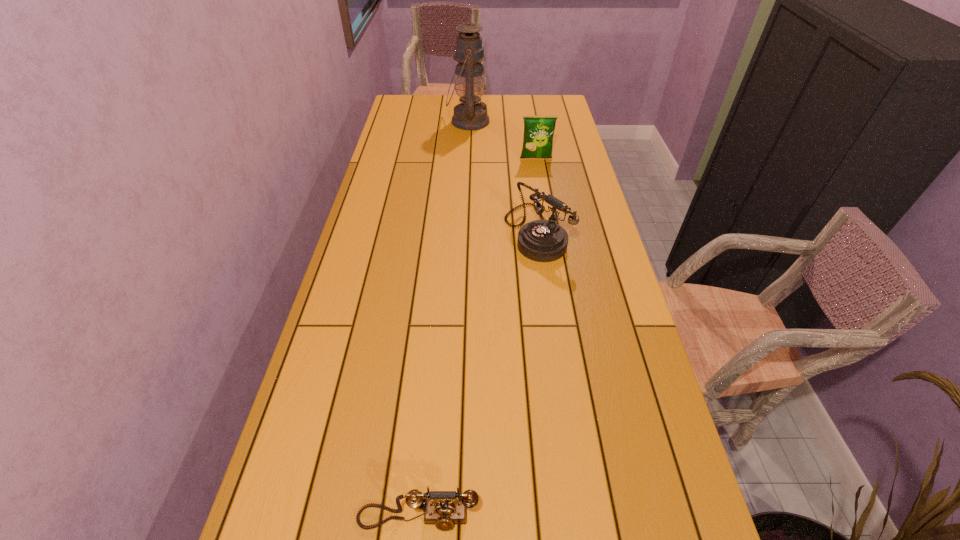
You are a GUI agent. You are given a task and a screenshot of the screen. Output one action in this format:
    pyautogui.click(x=<x>, y=<y>)
    Task: Click on the object that is at the far edge
    
    Given the screenshot: What is the action you would take?
    pyautogui.click(x=469, y=53)

Image resolution: width=960 pixels, height=540 pixels. I want to click on crisp (potato chip) that is at the right edge, so tap(538, 130).

You are a GUI agent. You are given a task and a screenshot of the screen. Output one action in this format:
    pyautogui.click(x=<x>, y=<y>)
    Task: Click on the telephone present at the right edge
    The width and height of the screenshot is (960, 540).
    Given the screenshot: What is the action you would take?
    pyautogui.click(x=543, y=240)

What are the coordinates of `free space at the far edge of the desktop` in the screenshot? It's located at (486, 98).

In the image, there is a desktop. At what (x,y) coordinates should I click in order to perform the action: click on vacant space at the left edge. Please return your answer as a coordinate pair (x, y). This screenshot has width=960, height=540. Looking at the image, I should click on (356, 358).

In the image, there is a desktop. Where is `vacant area at the right edge`? The image size is (960, 540). vacant area at the right edge is located at coordinates (607, 269).

I want to click on vacant region at the far left corner of the desktop, so click(409, 114).

This screenshot has height=540, width=960. I want to click on free space at the far right corner of the desktop, so click(555, 116).

Locate an element on the screen. This screenshot has width=960, height=540. free space between the third farthest object and the left telephone is located at coordinates (477, 375).

Identify the location of free spot between the oil lamp and the shortest object. (444, 320).